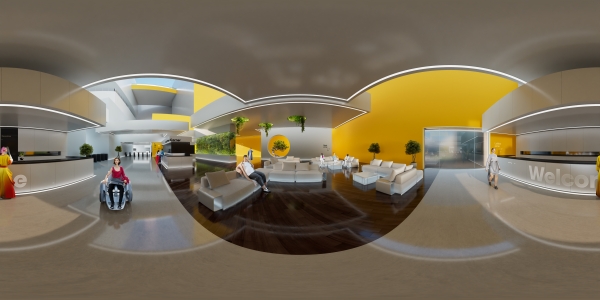
Where is `counter`? This screenshot has width=600, height=300. counter is located at coordinates (551, 177).